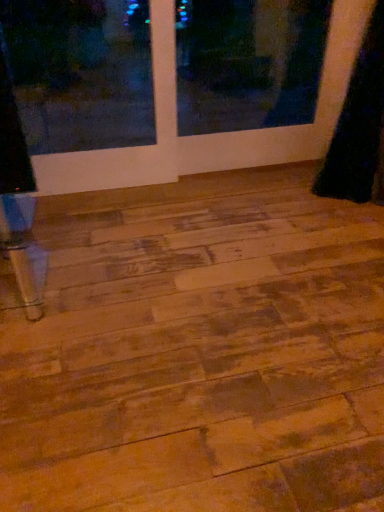
Measure the distance between point (294,382) and camera.

Point (294,382) is 1.18 meters away from camera.

What do you see at coordinates (197, 351) in the screenshot? I see `natural wood floor at center` at bounding box center [197, 351].

In order to face natural wood floor at center, should I rotate leftwards or rightwards?

Rotate right and turn 10.071 degrees.

This screenshot has height=512, width=384. Find the location of `natural wood floor at center`. natural wood floor at center is located at coordinates (197, 351).

Where is `natural wood floor at center`? natural wood floor at center is located at coordinates (197, 351).